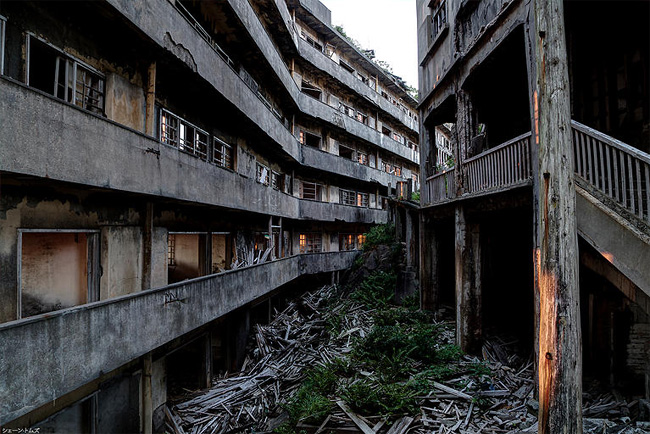
The height and width of the screenshot is (434, 650). What are the coordinates of `stair rails` in the screenshot? It's located at (478, 172), (498, 171), (511, 171), (430, 186), (593, 174).